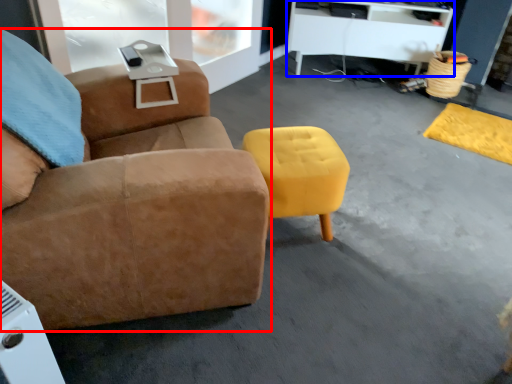
Question: Which point is closer to the camera, chair (highlighted by a red box) or desk (highlighted by a blue box)?

Choices:
 (A) chair
 (B) desk

Answer: (A)